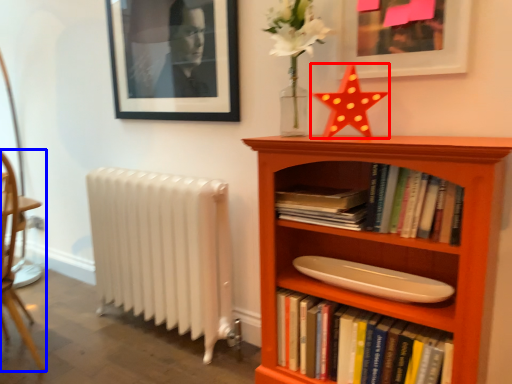
Question: Which of the following is the closest to the observer, chiffonier (highlighted by a red box) or chair (highlighted by a blue box)?

Choices:
 (A) chiffonier
 (B) chair

Answer: (A)